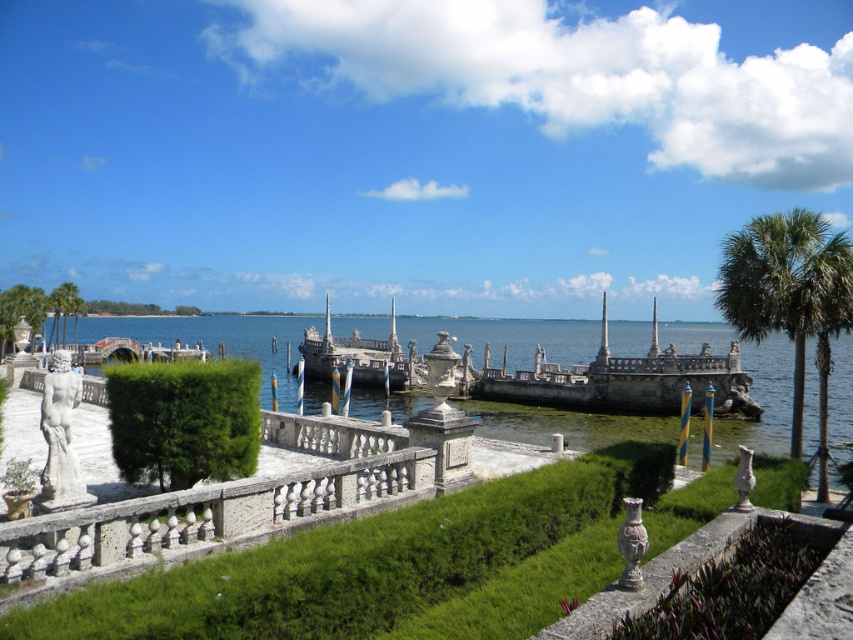
Question: Based on their relative distances, which object is farther from the green leafy hedge at center?

Choices:
 (A) green leafy palm tree at right
 (B) stone boat at center
 (C) green stone hedge at center

Answer: (B)

Question: Among these points, which one is nearest to the camera?

Choices:
 (A) (636, 620)
 (B) (381, 352)

Answer: (A)

Question: Is stone pier at center below stone boat at center?

Choices:
 (A) no
 (B) yes

Answer: (B)

Question: Is green leafy hedge at center wider than stone pier at center?

Choices:
 (A) yes
 (B) no

Answer: (B)

Question: Can you confirm if green stone hedge at center is wider than stone pier at center?

Choices:
 (A) no
 (B) yes

Answer: (A)

Question: Which point is farther to the camera?

Choices:
 (A) (282, 362)
 (B) (762, 218)
 (C) (785, 547)

Answer: (A)